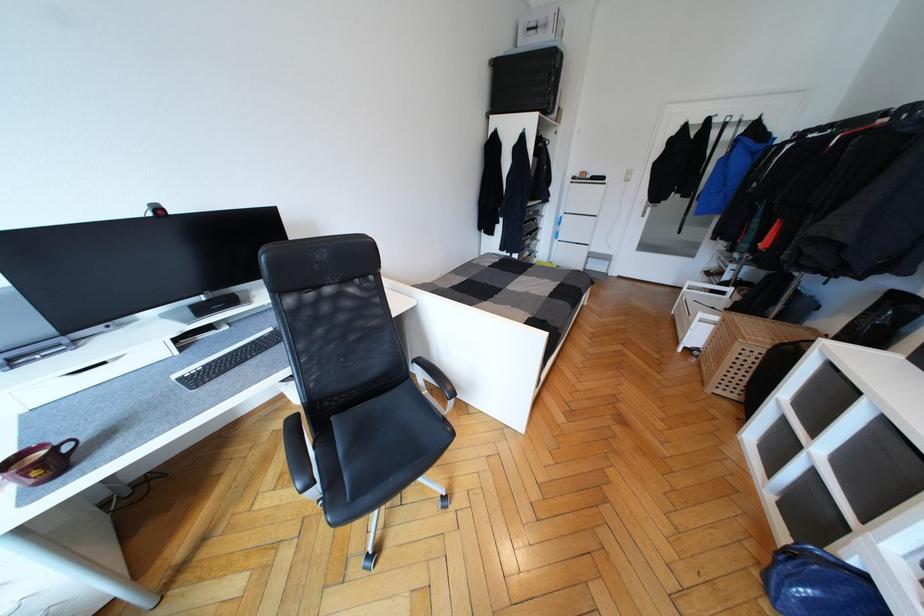
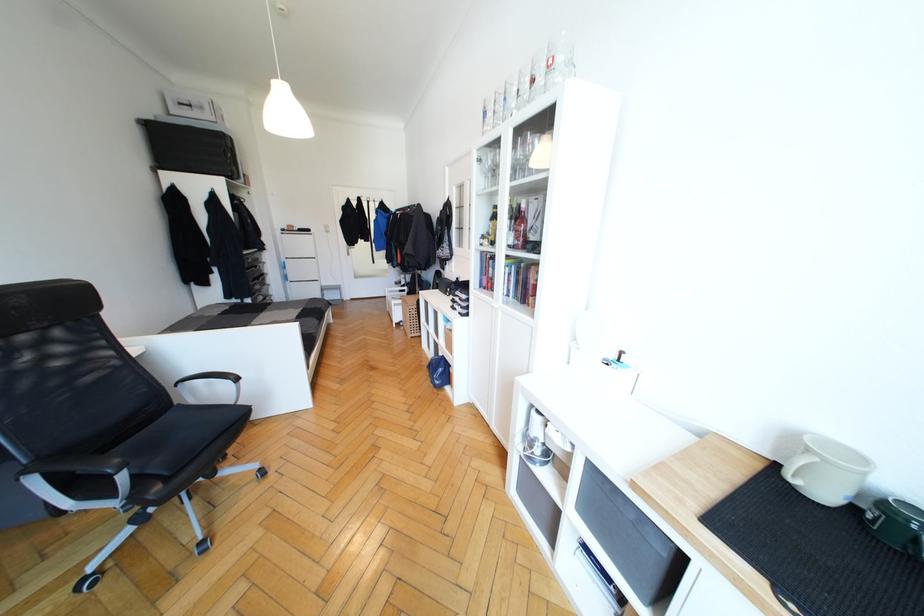
Locate, in the second image, the point that corresponds to [540,29] in the first image.

(193, 108)